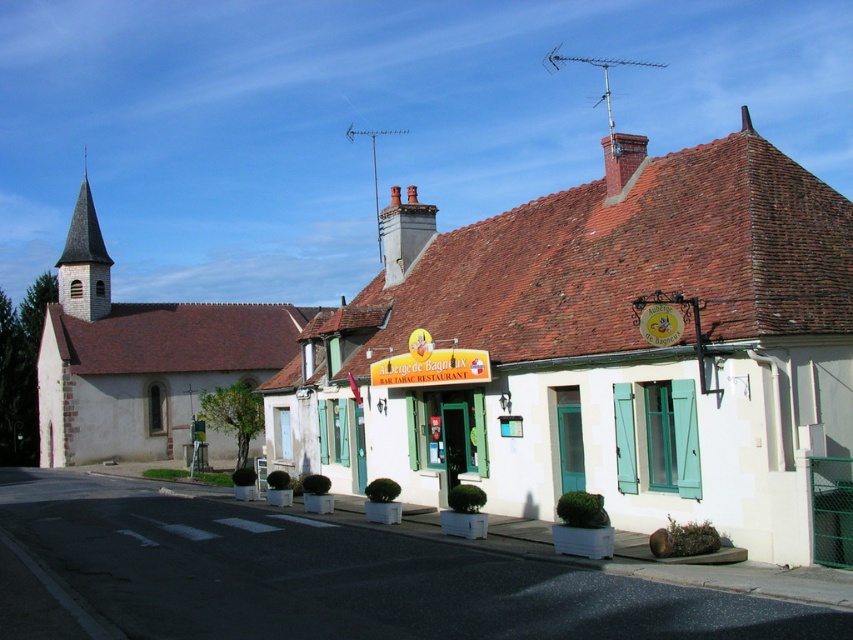
Is stone church at left in front of smooth gray steeple at left?

Yes, stone church at left is in front of smooth gray steeple at left.

Who is positioned more to the right, stone church at left or smooth gray steeple at left?

stone church at left

Does point (136, 445) come in front of point (76, 243)?

Yes, it is.

Find the location of a particular element. The width and height of the screenshot is (853, 640). stone church at left is located at coordinates (140, 356).

Measure the distance between white painted wood church at center and camera.

white painted wood church at center is 40.74 feet from camera.

Can you confirm if white painted wood church at center is bigger than smooth gray steeple at left?

Yes, white painted wood church at center is bigger than smooth gray steeple at left.

Image resolution: width=853 pixels, height=640 pixels. I want to click on white painted wood church at center, so click(596, 348).

I want to click on white painted wood church at center, so click(596, 348).

Is white painted wood church at center to the right of stone church at left from the viewer's perspective?

Correct, you'll find white painted wood church at center to the right of stone church at left.

Is white painted wood church at center taller than stone church at left?

Yes.

Who is more distant from viewer, [737,445] or [120,342]?

The point [120,342] is behind.

Where is `white painted wood church at center`? white painted wood church at center is located at coordinates (596, 348).